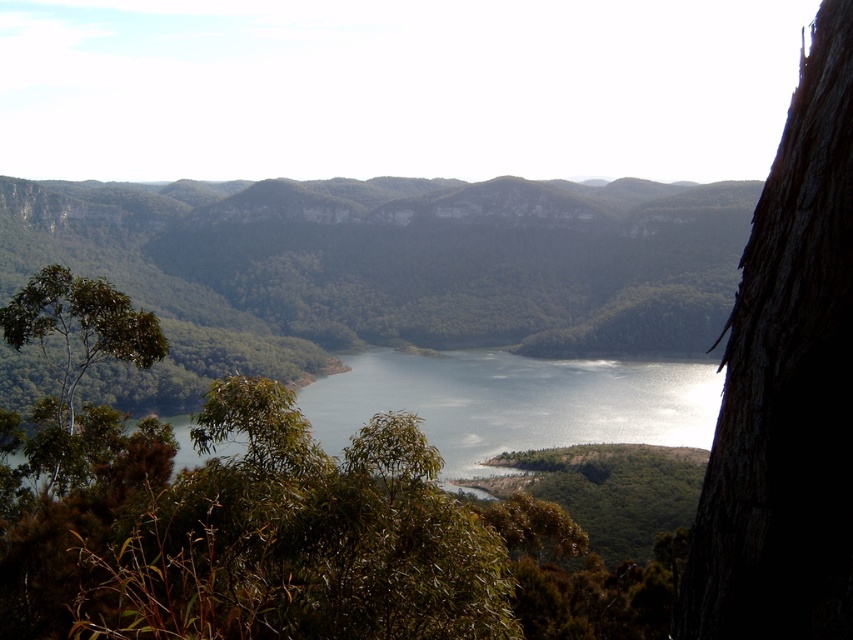
You are standing in the middle of the valley and see the brown rough bark tree at right and the green leafy tree at left. Which tree would appear taller to you?

The green leafy tree at left appears taller than the brown rough bark tree at right.

You are standing at the edge of the lake and looking towards the mountains. Which object, the green leafy forest at center or the green leafy tree at left, is positioned higher in your field of view?

The green leafy forest at center is positioned higher in your field of view than the green leafy tree at left because it is located above it according to the description.

You are an environmental scientist assessing the ecological balance of this landscape. Which object, the green leafy forest at center or the brown rough bark tree at right, occupies a more significant area in the scene?

The green leafy forest at center has a larger size compared to the brown rough bark tree at right, so it occupies a more significant area in the scene.